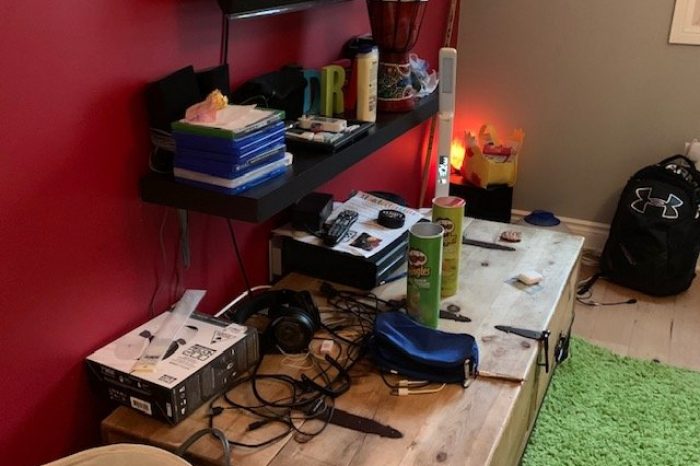
Locate an element on the screen. The width and height of the screenshot is (700, 466). black shelf is located at coordinates (253, 205).